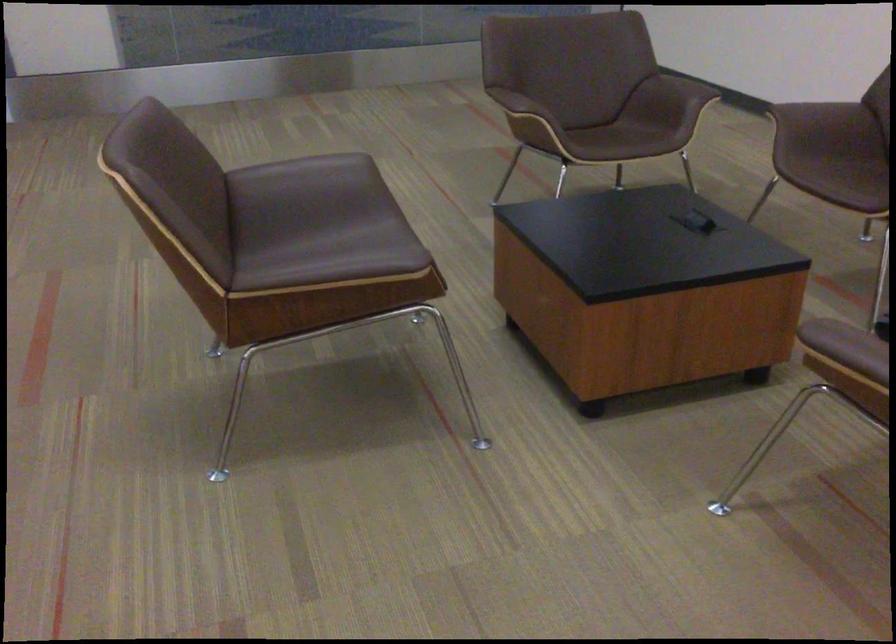
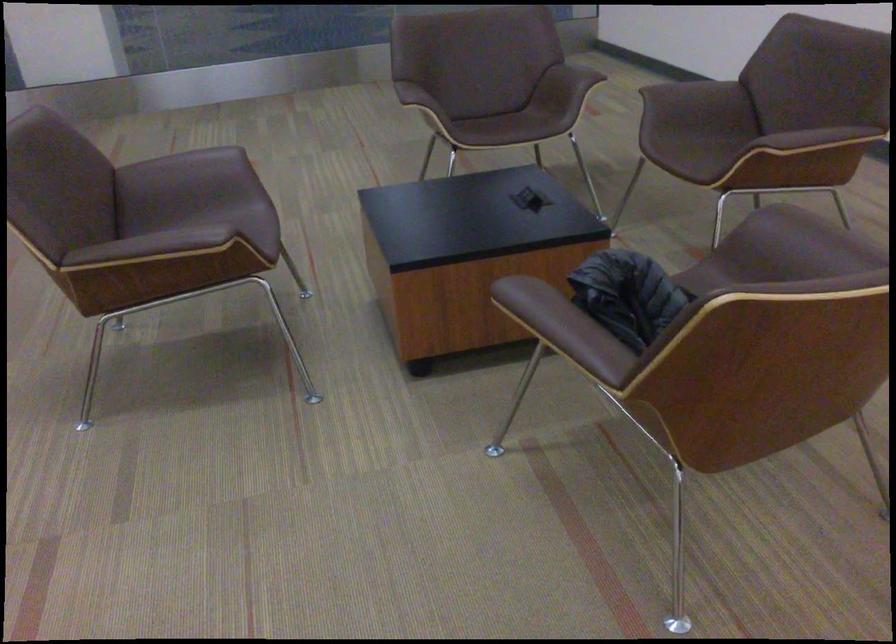
Locate, in the second image, the point that corresponds to the point at 320,167 in the first image.

(193, 162)